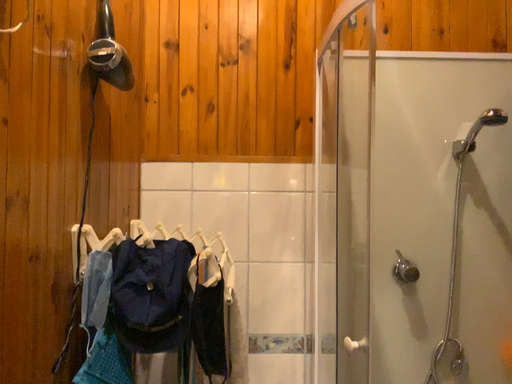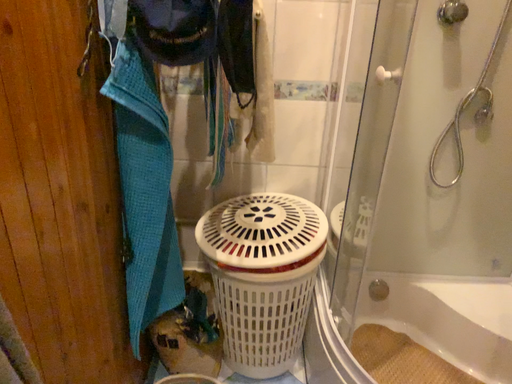
Question: How did the camera likely rotate when shooting the video?

Choices:
 (A) rotated upward
 (B) rotated downward

Answer: (B)